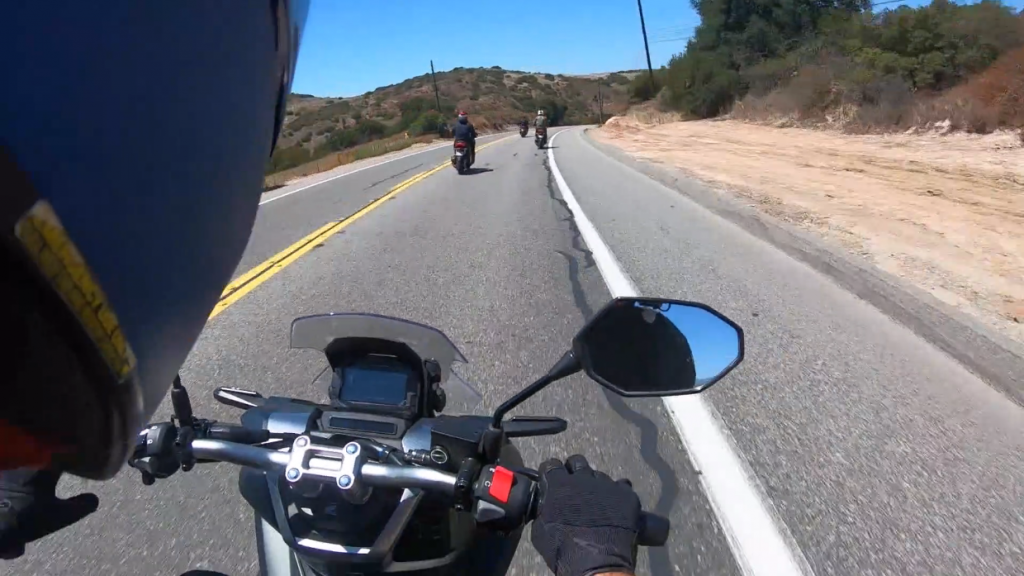
You are a GUI agent. You are given a task and a screenshot of the screen. Output one action in this format:
    pyautogui.click(x=<x>, y=<y>)
    Task: Click on the handle
    The image size is (1024, 576).
    Given the screenshot: What is the action you would take?
    pyautogui.click(x=649, y=522)